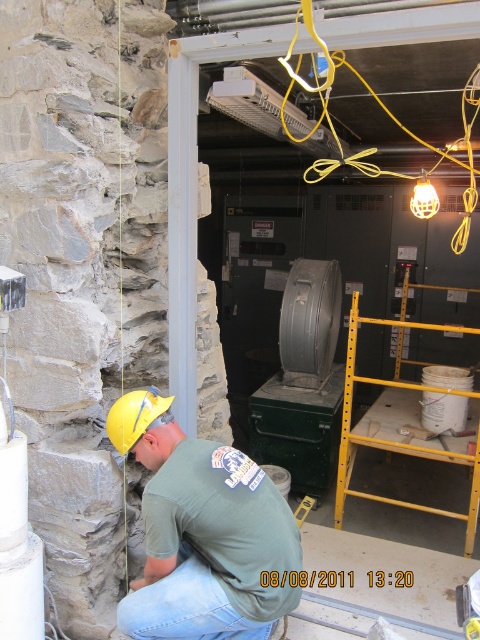
Identify the location of green fabric shirt at lower center. This screenshot has width=480, height=640. (202, 532).

What do you see at coordinates (202, 532) in the screenshot? I see `green fabric shirt at lower center` at bounding box center [202, 532].

At what (x,y) coordinates should I click in order to perform the action: click on green fabric shirt at lower center. Please return your answer as a coordinate pair (x, y). Looking at the image, I should click on (202, 532).